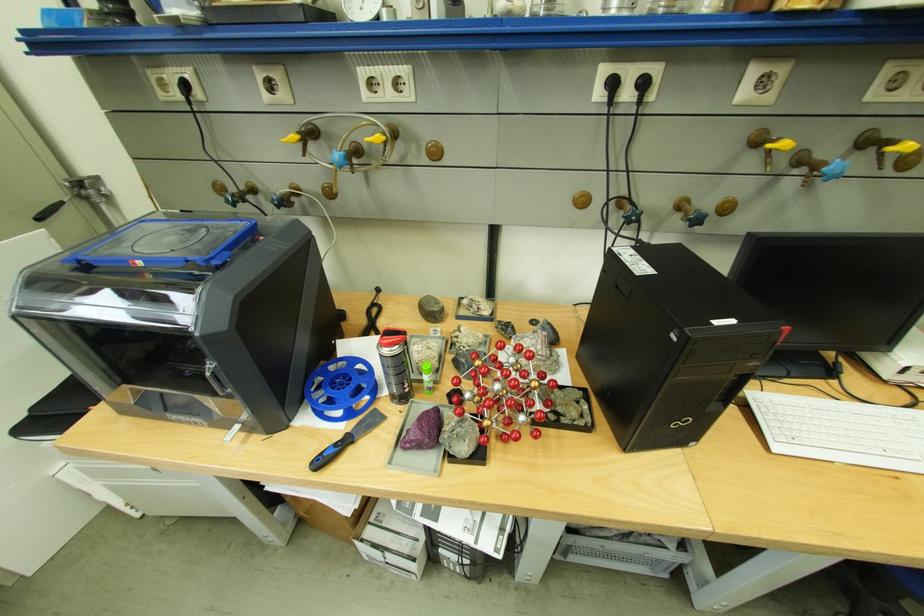
The location [460,438] corresponds to which object?

This point indicates the smooth grey stone.